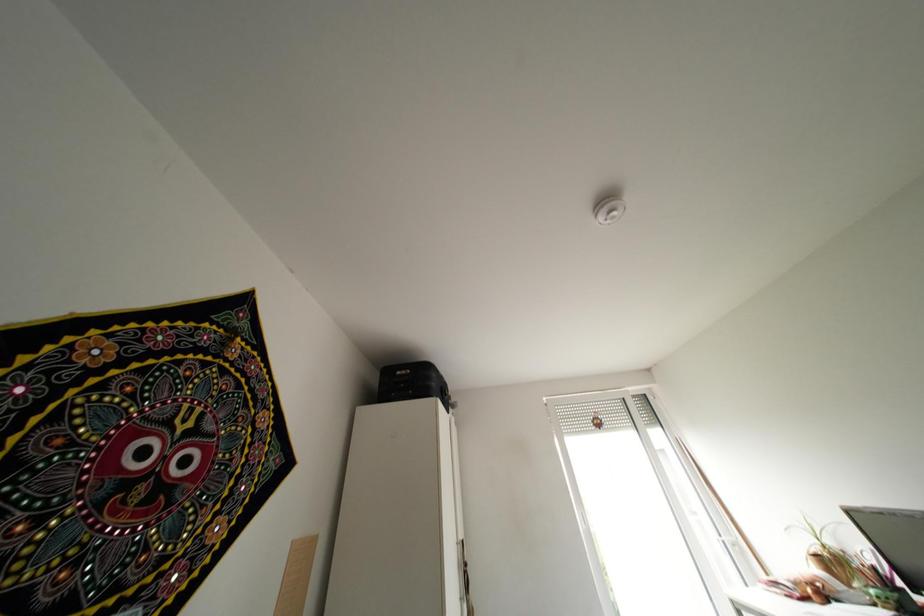
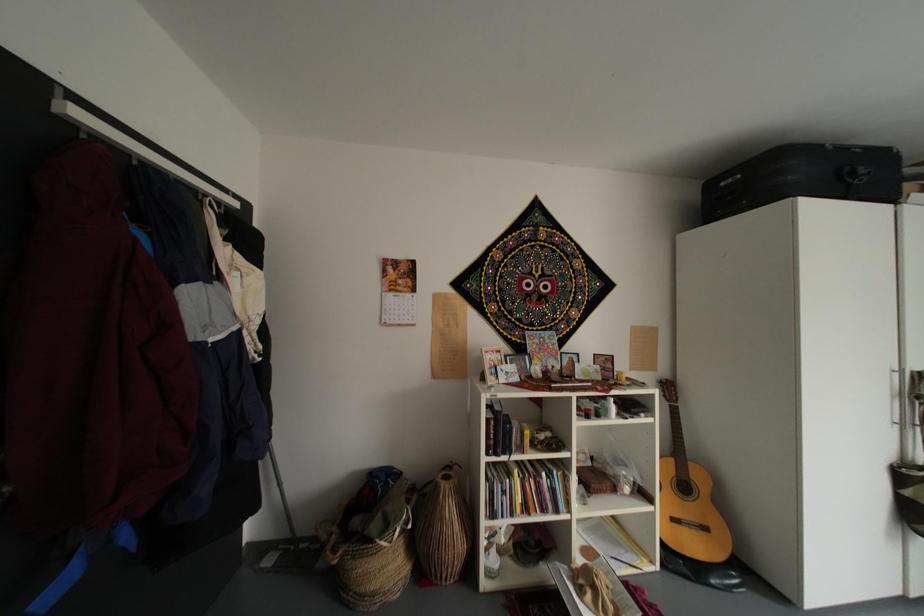
Question: The first image is from the beginning of the video and the second image is from the end. How did the camera likely rotate when shooting the video?

Choices:
 (A) Left
 (B) Right
 (C) Up
 (D) Down

Answer: (A)